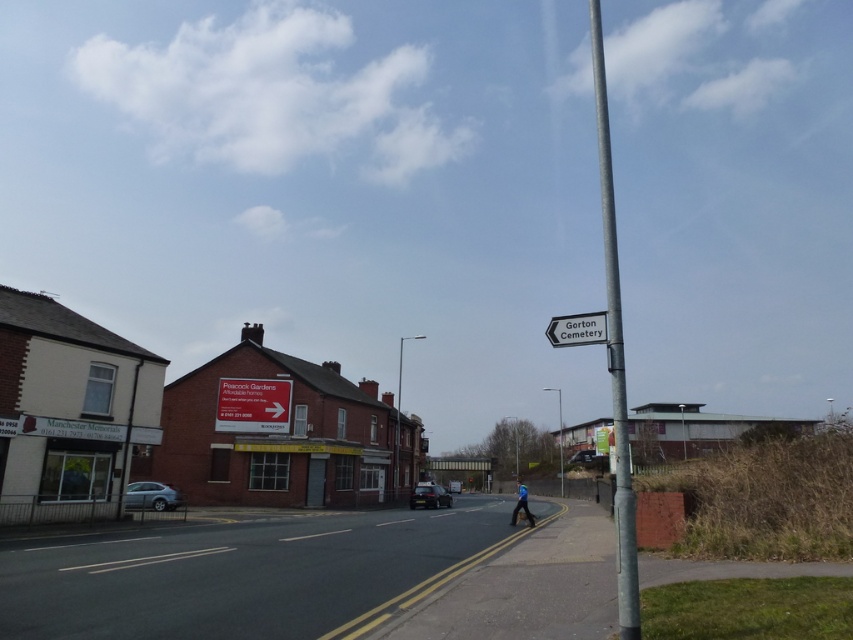
Question: Considering the real-world distances, which object is farthest from the white plastic sign at upper center?

Choices:
 (A) silver metallic pole at right
 (B) blue fabric person at lower center
 (C) white plastic sign at center

Answer: (A)

Question: Does white plastic sign at upper center have a greater width compared to blue fabric person at lower center?

Choices:
 (A) yes
 (B) no

Answer: (A)

Question: Among these objects, which one is nearest to the camera?

Choices:
 (A) white plastic sign at upper center
 (B) silver metallic pole at right
 (C) white plastic sign at center
 (D) blue fabric person at lower center

Answer: (B)

Question: Is white plastic sign at center below blue fabric person at lower center?

Choices:
 (A) yes
 (B) no

Answer: (B)

Question: Considering the relative positions of white plastic sign at center and white plastic sign at upper center in the image provided, where is white plastic sign at center located with respect to white plastic sign at upper center?

Choices:
 (A) right
 (B) left

Answer: (B)

Question: Which of the following is the closest to the observer?

Choices:
 (A) (517, 500)
 (B) (561, 333)

Answer: (B)